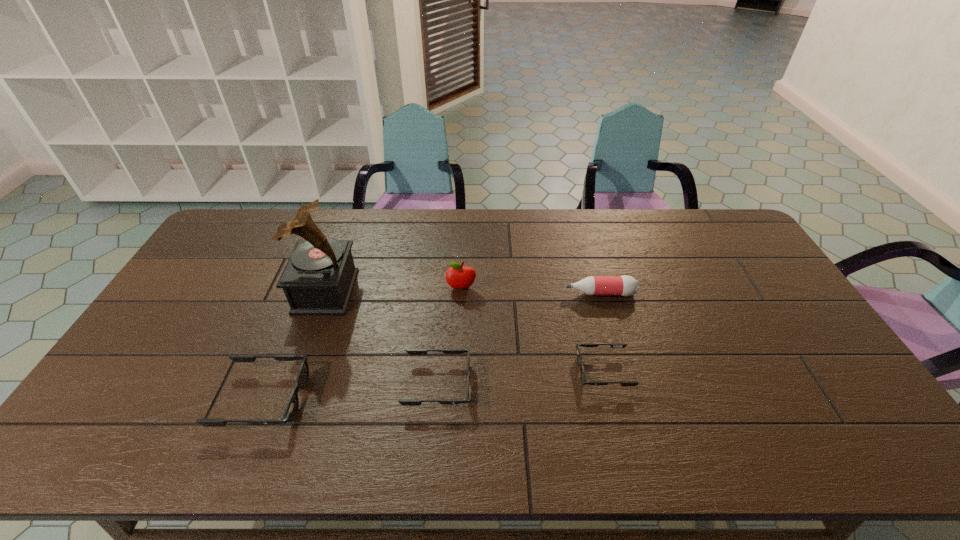
I want to click on free spot located on the temples of the shortest object, so click(x=514, y=371).

The width and height of the screenshot is (960, 540). Find the location of `vacant space located on the temples of the shortest object`. vacant space located on the temples of the shortest object is located at coordinates (551, 371).

What are the coordinates of `vacant space positioned on the temples of the shortest object` in the screenshot? It's located at (492, 371).

Locate an element on the screen. vacant position located with the cap open on the bottle is located at coordinates 542,293.

Identify the location of blank space located with the cap open on the bottle. (492, 293).

The width and height of the screenshot is (960, 540). In order to click on vacant area located 0.270m with the cap open on the bottle in this screenshot , I will do `click(479, 293)`.

The width and height of the screenshot is (960, 540). Find the location of `vacant area located on the front of the fifth shortest object`. vacant area located on the front of the fifth shortest object is located at coordinates (457, 378).

You are a GUI agent. You are given a task and a screenshot of the screen. Output one action in this format:
    pyautogui.click(x=<x>, y=<y>)
    Task: Click on the vacant position located at the horn opening of the tallest object
    Image resolution: width=960 pixels, height=540 pixels.
    Given the screenshot: What is the action you would take?
    pyautogui.click(x=425, y=291)

Locate an element on the screen. This screenshot has height=540, width=960. free space at the far edge is located at coordinates (498, 234).

Find the location of a particular element. free space at the near edge is located at coordinates (244, 414).